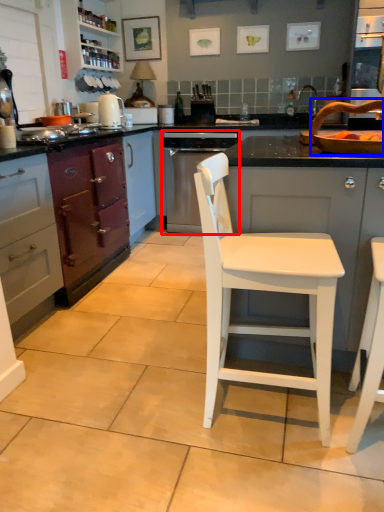
Question: Which object is closer to the camera taking this photo, home appliance (highlighted by a red box) or sink (highlighted by a blue box)?

Choices:
 (A) home appliance
 (B) sink

Answer: (B)